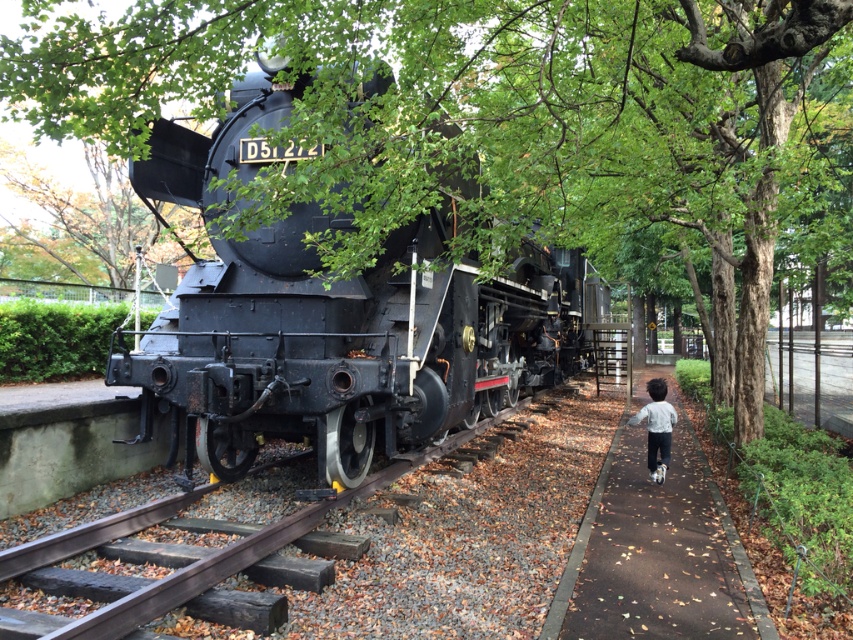
Question: Is matte black locomotive at center thinner than light gray fleece jacket at lower right?

Choices:
 (A) yes
 (B) no

Answer: (B)

Question: Which point is closer to the camera taking this photo?

Choices:
 (A) (207, 577)
 (B) (248, 465)
 (C) (650, 476)

Answer: (A)

Question: From the image, what is the correct spatial relationship of matte black locomotive at center in relation to brown asphalt path at lower right?

Choices:
 (A) left
 (B) right

Answer: (A)

Question: Is brown asphalt path at lower right further to camera compared to light gray fleece jacket at lower right?

Choices:
 (A) yes
 (B) no

Answer: (B)

Question: Among these points, which one is nearest to the camera?

Choices:
 (A) (625, 483)
 (B) (189, 424)
 (C) (132, 611)

Answer: (C)

Question: Which of the following is the farthest from the observer?

Choices:
 (A) black metal track at center
 (B) brown asphalt path at lower right
 (C) matte black locomotive at center

Answer: (C)